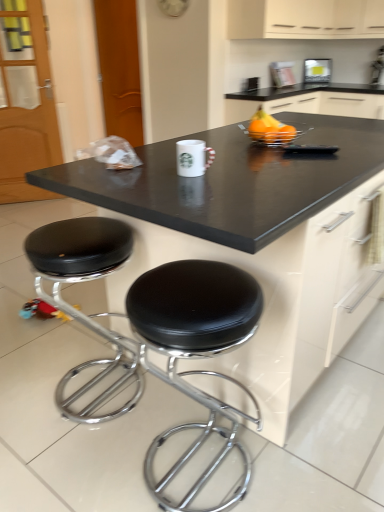
Question: Is matte plastic light at upper center taller or shorter than cream matte cabinet at upper center?

Choices:
 (A) tall
 (B) short

Answer: (B)

Question: From a real-world perspective, relative to cream matte cabinet at upper center, is matte plastic light at upper center vertically above or below?

Choices:
 (A) above
 (B) below

Answer: (B)

Question: Which object is the farthest from the black laminate countertop at center?

Choices:
 (A) black leather stool at lower center, which ranks as the 1th stool in right-to-left order
 (B) matte plastic light at upper center
 (C) cream matte cabinet at upper center
 (D) black leather stool at lower left, which is the 2th stool in right-to-left order
 (E) shiny orange fruit at upper right

Answer: (B)

Question: Based on their relative distances, which object is farther from the black laminate countertop at center?

Choices:
 (A) black leather stool at lower left, positioned as the first stool in left-to-right order
 (B) shiny orange fruit at upper right
 (C) black leather stool at lower center, which ranks as the 1th stool in right-to-left order
 (D) matte plastic light at upper center
 (E) cream matte cabinet at upper center

Answer: (D)